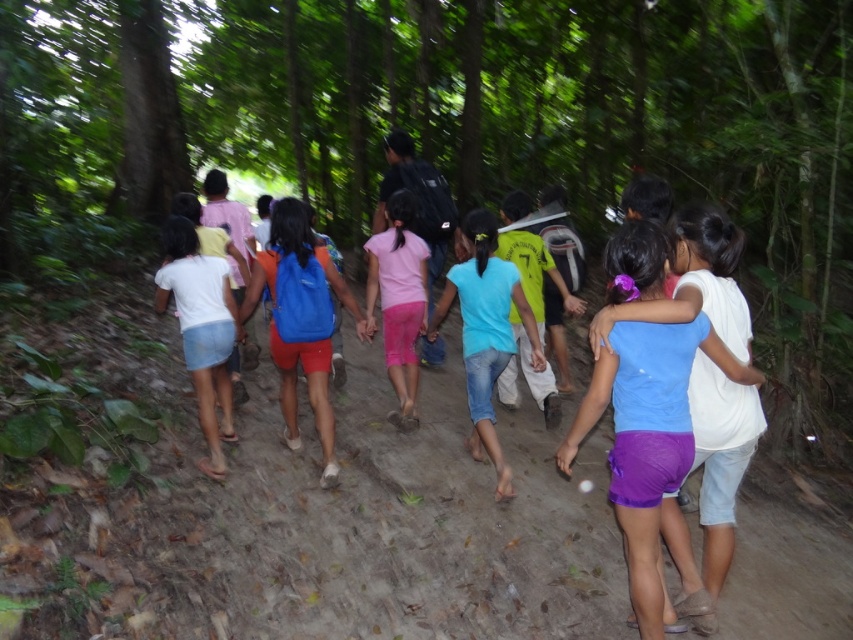
You are a photographer trying to capture a clear shot of the matte blue shirt at center and the pink matte shorts at center. Since the image is slightly blurred, which object should you focus on to ensure it appears clearer in the photo?

The matte blue shirt at center has a greater width than the pink matte shorts at center, so focusing on the matte blue shirt at center would result in a clearer image due to its larger size.